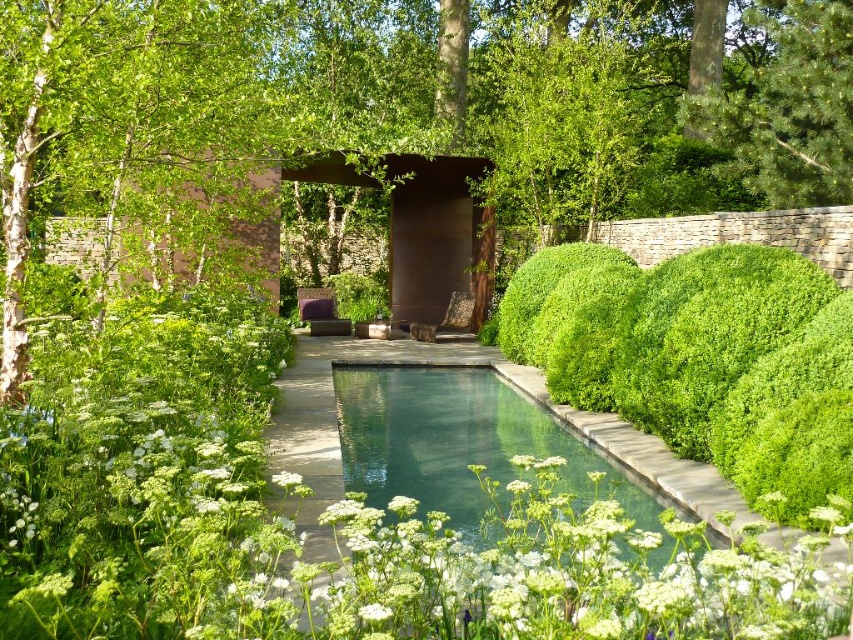
Is green leafy hedge at right further to the viewer compared to green pine tree at upper right?

A: That is False.

Does point (608, 355) come closer to viewer compared to point (833, 179)?

Yes.

What do you see at coordinates (700, 356) in the screenshot? This screenshot has width=853, height=640. I see `green leafy hedge at right` at bounding box center [700, 356].

The image size is (853, 640). Identify the location of green leafy hedge at right. (700, 356).

The width and height of the screenshot is (853, 640). What do you see at coordinates (422, 104) in the screenshot?
I see `green leafy tree at center` at bounding box center [422, 104].

Is point (851, 122) farther from viewer compared to point (338, 426)?

Yes, point (851, 122) is farther from viewer.

Who is more distant from viewer, (363, 81) or (399, 368)?

Positioned behind is point (363, 81).

Identify the location of green leafy tree at center. The width and height of the screenshot is (853, 640). (422, 104).

Is green leafy tree at center positioned before green leafy hedge at right?

Yes.

Who is more distant from viewer, (712, 64) or (567, 292)?

Point (712, 64)

Measure the distance between green leafy tree at center and camera.

4.50 meters

Where is `green leafy tree at center`? This screenshot has width=853, height=640. green leafy tree at center is located at coordinates (422, 104).